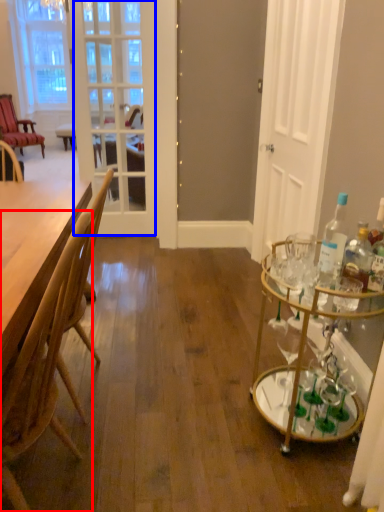
Question: Which object is closer to the camera taking this photo, chair (highlighted by a red box) or screen door (highlighted by a blue box)?

Choices:
 (A) chair
 (B) screen door

Answer: (A)